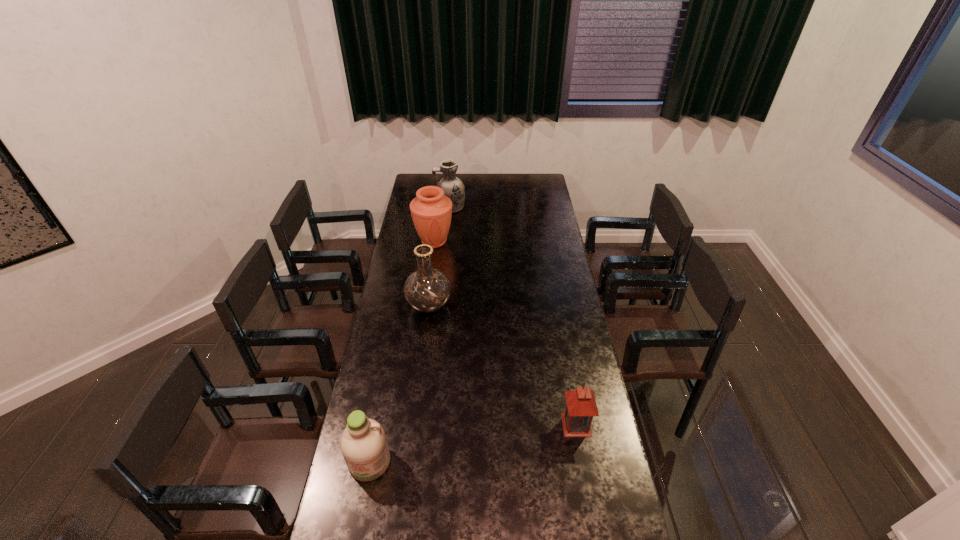
Identify the location of vacant space located with the handle on the side of the farthest object. (421, 207).

The image size is (960, 540). In order to click on vacant area located on the front label of the nearest object in this screenshot , I will do `click(358, 519)`.

Find the location of a particular element. Image resolution: width=960 pixels, height=540 pixels. free space located 0.220m on the front of the lantern is located at coordinates (590, 504).

Identify the location of cleansing agent at the left edge. (363, 443).

This screenshot has width=960, height=540. Identify the location of object that is at the right edge. (581, 406).

In the image, there is a desktop. Identify the location of free space at the far edge. (495, 176).

This screenshot has height=540, width=960. Find the location of `free region at the left edge`. free region at the left edge is located at coordinates (414, 251).

Locate an element on the screen. The width and height of the screenshot is (960, 540). free space at the right edge is located at coordinates (539, 250).

Where is `free space that is in between the rightmost object and the second farthest object`? The image size is (960, 540). free space that is in between the rightmost object and the second farthest object is located at coordinates (505, 333).

The height and width of the screenshot is (540, 960). Identify the location of free point between the nearest object and the lantern. (472, 443).